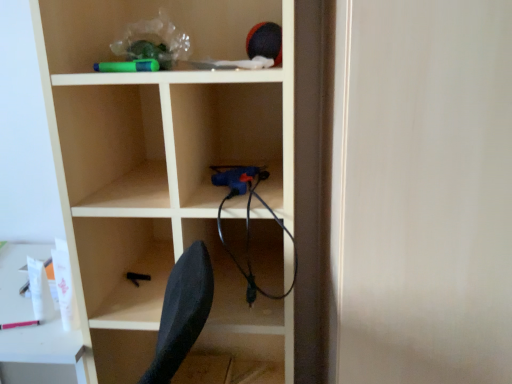
Question: Is white glossy table at lower left shorter than wooden shelf at center?

Choices:
 (A) no
 (B) yes

Answer: (B)

Question: Is white glossy table at lower left bigger than wooden shelf at center?

Choices:
 (A) yes
 (B) no

Answer: (B)

Question: Is white glossy table at lower left thinner than wooden shelf at center?

Choices:
 (A) yes
 (B) no

Answer: (B)

Question: Considering the relative sizes of white glossy table at lower left and wooden shelf at center in the image provided, is white glossy table at lower left wider than wooden shelf at center?

Choices:
 (A) no
 (B) yes

Answer: (B)

Question: Is white glossy table at lower left touching wooden shelf at center?

Choices:
 (A) yes
 (B) no

Answer: (B)

Question: Does white glossy table at lower left come in front of wooden shelf at center?

Choices:
 (A) yes
 (B) no

Answer: (B)

Question: Can you confirm if wooden shelf at center is bigger than white glossy table at lower left?

Choices:
 (A) yes
 (B) no

Answer: (A)

Question: From the image's perspective, is wooden shelf at center below white glossy table at lower left?

Choices:
 (A) no
 (B) yes

Answer: (A)

Question: Is wooden shelf at center far away from white glossy table at lower left?

Choices:
 (A) yes
 (B) no

Answer: (B)

Question: Does wooden shelf at center come behind white glossy table at lower left?

Choices:
 (A) no
 (B) yes

Answer: (A)

Question: Considering the relative sizes of wooden shelf at center and white glossy table at lower left in the image provided, is wooden shelf at center thinner than white glossy table at lower left?

Choices:
 (A) yes
 (B) no

Answer: (A)

Question: Is wooden shelf at center oriented away from white glossy table at lower left?

Choices:
 (A) yes
 (B) no

Answer: (B)

Question: Is point (237, 220) positioned closer to the camera than point (17, 299)?

Choices:
 (A) farther
 (B) closer

Answer: (B)